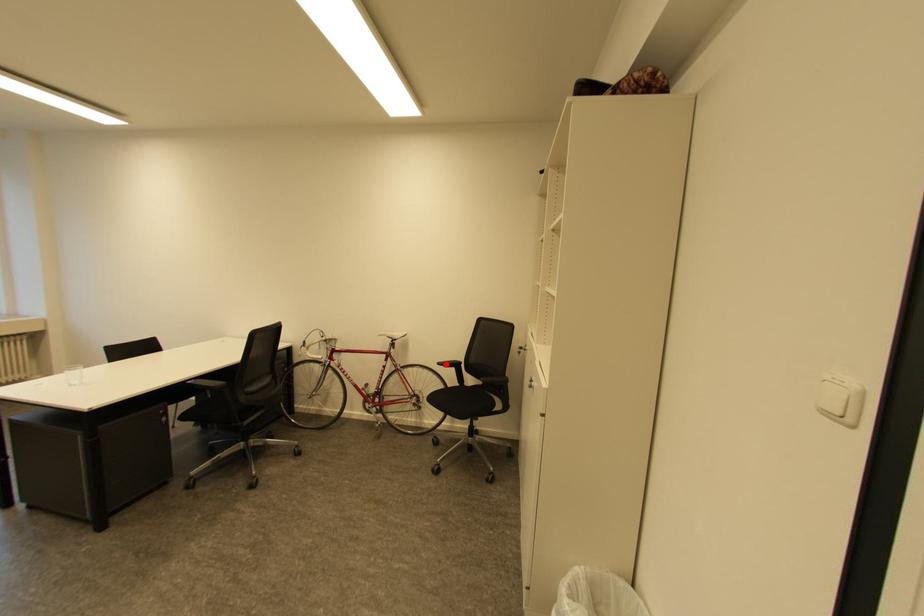
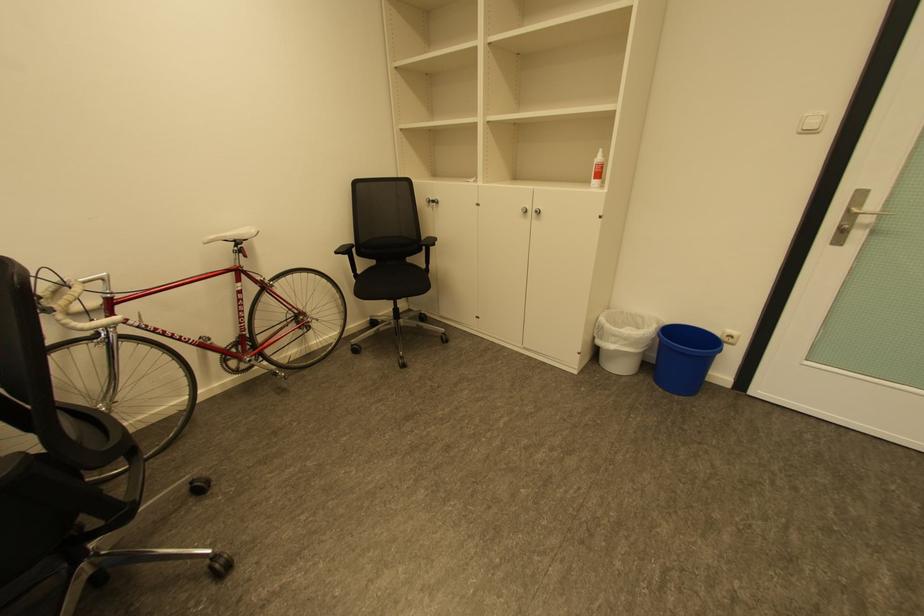
Question: I am providing you with two images of the same scene from different viewpoints. Image1 has a red point marked. In image2, the corresponding 3D location appears at what relative position? Reply with the corresponding letter.

Choices:
 (A) Closer
 (B) Farther

Answer: (A)